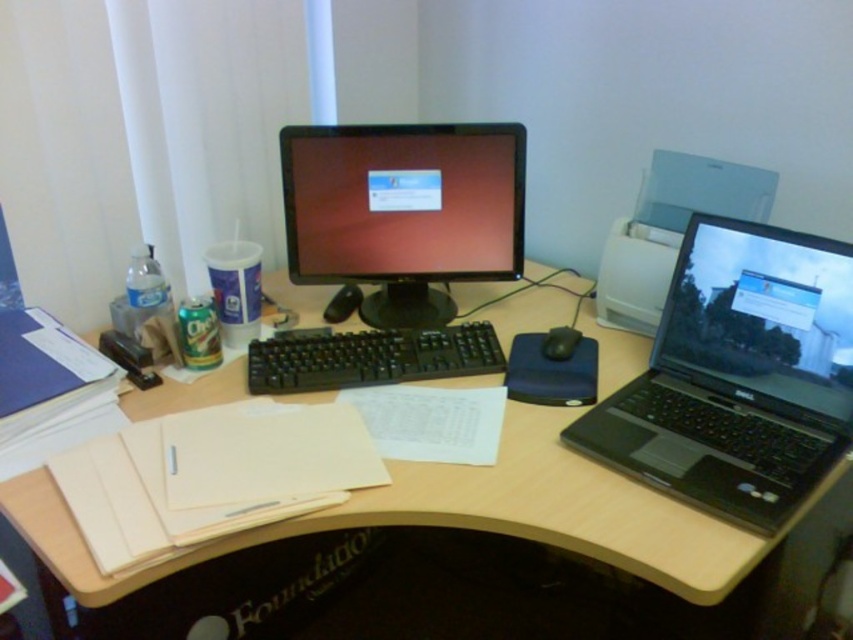
Who is positioned more to the left, black plastic laptop at right or black rubber mouse at center?

black rubber mouse at center

Is black plastic laptop at right taller than black rubber mouse at center?

Yes, black plastic laptop at right is taller than black rubber mouse at center.

Does point (677, 264) come closer to viewer compared to point (544, 339)?

That is True.

In order to click on black plastic laptop at right in this screenshot , I will do `click(738, 376)`.

Is black plastic laptop at right in front of wooden at center?

No.

The width and height of the screenshot is (853, 640). Find the location of `black plastic laptop at right`. black plastic laptop at right is located at coordinates (738, 376).

What do you see at coordinates (761, 316) in the screenshot?
I see `matte black laptop at right` at bounding box center [761, 316].

Is point (775, 387) more distant than point (563, 358)?

No, (775, 387) is in front of (563, 358).

Locate an element on the screen. matte black laptop at right is located at coordinates (761, 316).

The image size is (853, 640). Find the location of `matte black laptop at right`. matte black laptop at right is located at coordinates (761, 316).